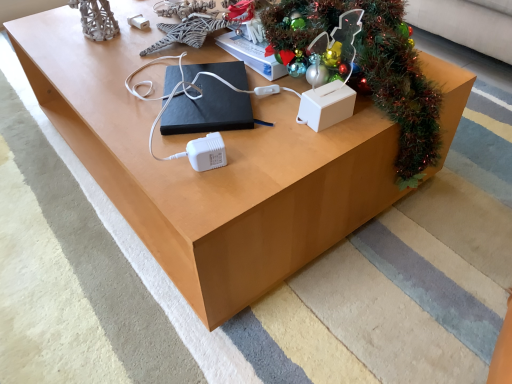
Find the location of a particular element. This screenshot has width=512, height=384. free location to the right of black matte book at center is located at coordinates (282, 107).